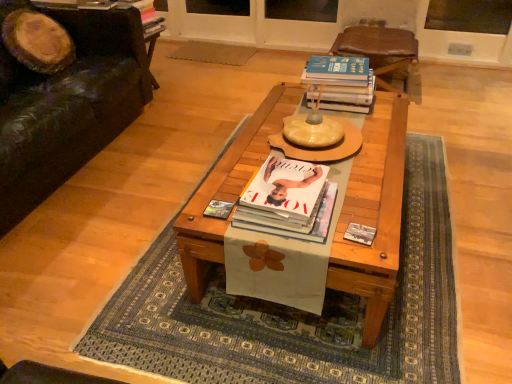
Identify the location of vacant space that is to the left of matte paper magazine at center. (193, 213).